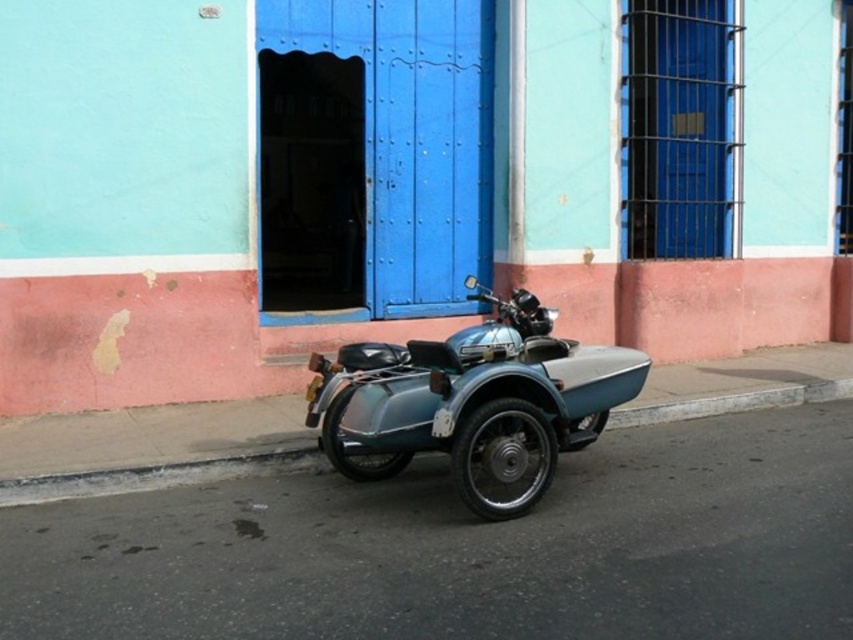
Question: Among these objects, which one is nearest to the camera?

Choices:
 (A) metallic teal motorcycle at center
 (B) gray concrete curb at lower left

Answer: (A)

Question: Does metallic teal motorcycle at center appear under gray concrete curb at lower left?

Choices:
 (A) yes
 (B) no

Answer: (B)

Question: Does metallic teal motorcycle at center lie behind gray concrete curb at lower left?

Choices:
 (A) no
 (B) yes

Answer: (A)

Question: Can you confirm if metallic teal motorcycle at center is bigger than gray concrete curb at lower left?

Choices:
 (A) yes
 (B) no

Answer: (B)